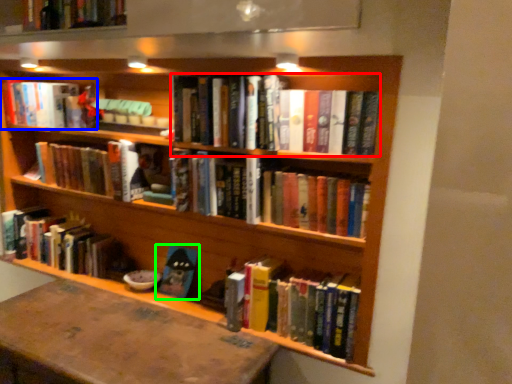
Question: Which object is the farthest from book (highlighted by a red box)? Choose among these: book (highlighted by a blue box) or book (highlighted by a green box).

Choices:
 (A) book
 (B) book

Answer: (A)